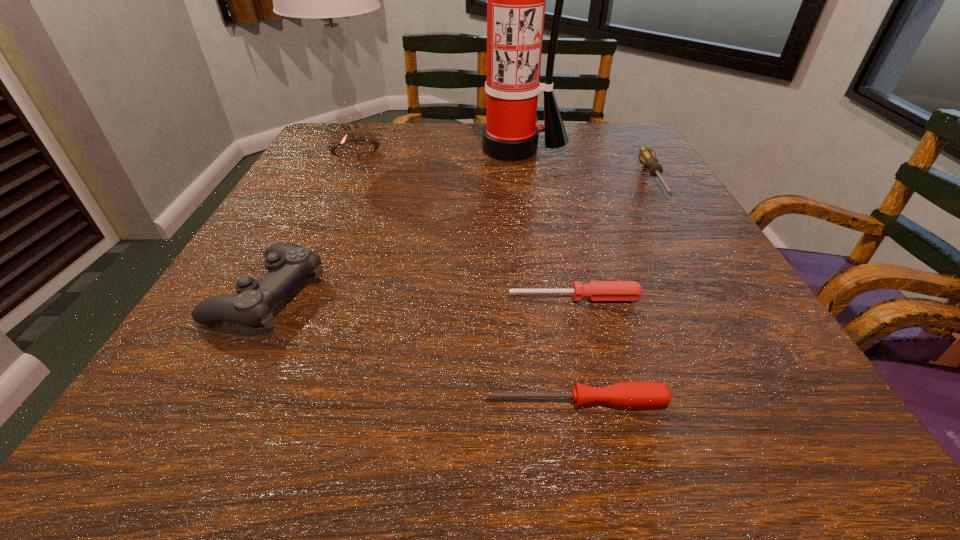
Image resolution: width=960 pixels, height=540 pixels. Identify the location of free area in between the fourth shortest object and the fire extinguisher. [391, 222].

Identify the location of vacant space that is in between the table lamp and the tallest object. (435, 149).

Where is `blank region between the nearest screwdriver and the fire extinguisher`? This screenshot has width=960, height=540. blank region between the nearest screwdriver and the fire extinguisher is located at coordinates (545, 275).

At what (x,y) coordinates should I click in order to perform the action: click on empty location between the nearest screwdriver and the tallest object. Please return your answer as a coordinate pair (x, y). This screenshot has width=960, height=540. Looking at the image, I should click on (545, 275).

This screenshot has width=960, height=540. I want to click on empty space between the fire extinguisher and the table lamp, so click(435, 149).

This screenshot has height=540, width=960. In order to click on blank region between the fire extinguisher and the tallest screwdriver in this screenshot , I will do `click(584, 164)`.

Locate an element on the screen. unoccupied position between the second nearest screwdriver and the nearest object is located at coordinates (575, 350).

Where is `unoccupied position between the rightmost screwdriver and the fire extinguisher`? The width and height of the screenshot is (960, 540). unoccupied position between the rightmost screwdriver and the fire extinguisher is located at coordinates (584, 164).

Find the location of a particular element. The image size is (960, 540). free space between the fifth shortest object and the tallest screwdriver is located at coordinates (504, 164).

This screenshot has height=540, width=960. Find the location of `vacant space that's between the tallest object and the second farthest screwdriver`. vacant space that's between the tallest object and the second farthest screwdriver is located at coordinates (544, 224).